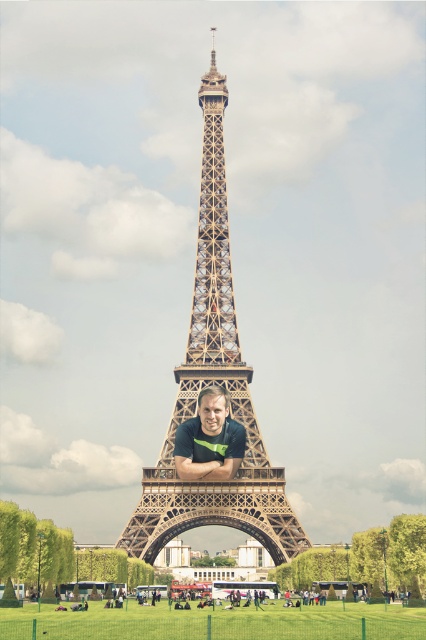
You are standing at the point marked as point (213,384). You want to take a photo of the brown metal eiffel tower at center. Which direction should you face to capture it in your shot?

The brown metal eiffel tower at center is located at point (213,384), so you should face directly towards that point to capture it in your photo.

You are a photographer wanting to capture a photo of the brown metal eiffel tower at center and the matte black shirt at center in the same frame. Considering their sizes, which object would appear larger in the photo?

The brown metal eiffel tower at center would appear larger in the photo because it has a greater height compared to the matte black shirt at center.

You are standing at the base of the Eiffel Tower and want to take a photo of the two points marked in the scene. Which point, point (210, 205) or point (222, 387), is closer to your camera when taking the photo?

Point (222, 387) is closer to the camera because it is less further away than point (210, 205) according to the description.